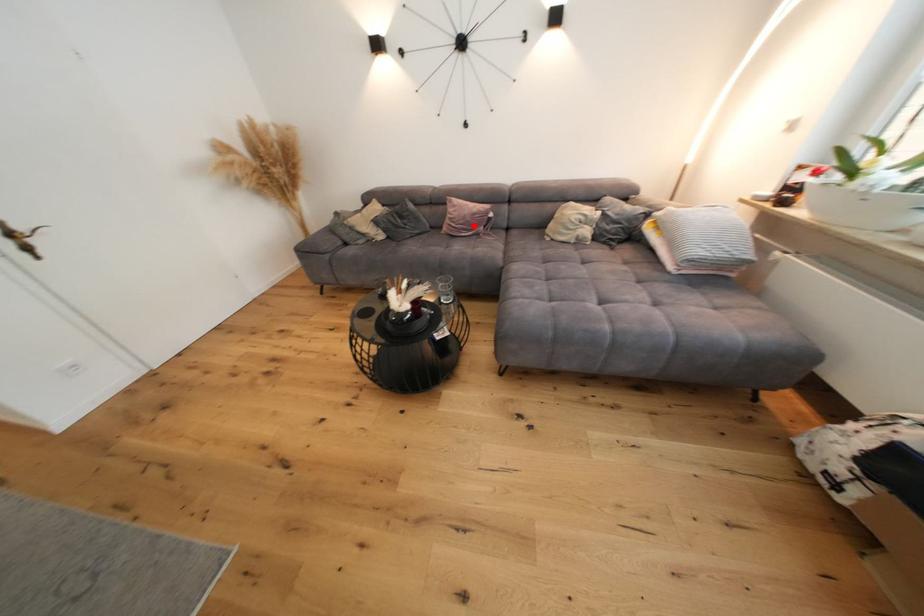
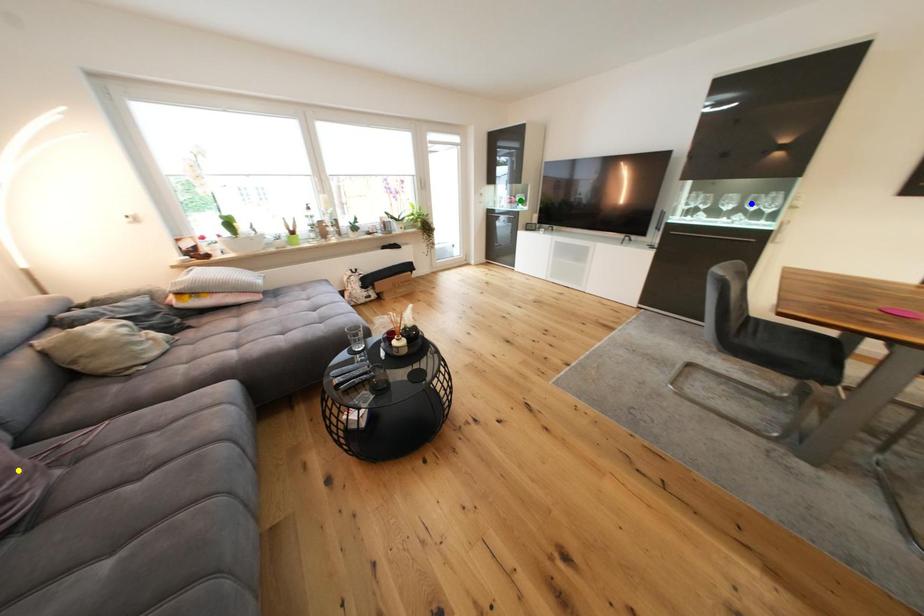
Question: I am providing you with two images of the same scene from different viewpoints. A red point is marked on the first image. You are given multiple points on the second image. Which point in image 2 represents the same 3d spot as the red point in image 1?

Choices:
 (A) green point
 (B) blue point
 (C) yellow point

Answer: (C)